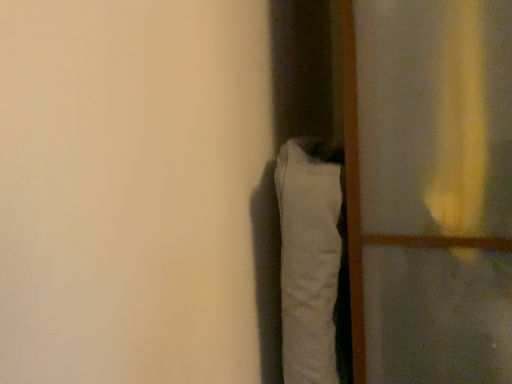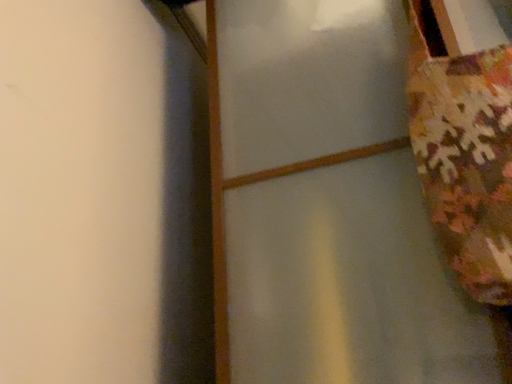
Question: Which way did the camera rotate in the video?

Choices:
 (A) rotated left
 (B) rotated right

Answer: (B)